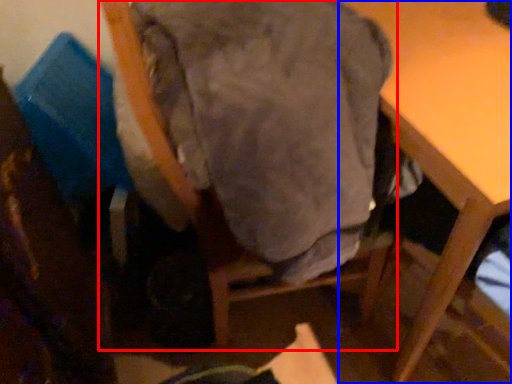
Question: Which point is further to the camera, chair (highlighted by a red box) or table (highlighted by a blue box)?

Choices:
 (A) chair
 (B) table

Answer: (B)